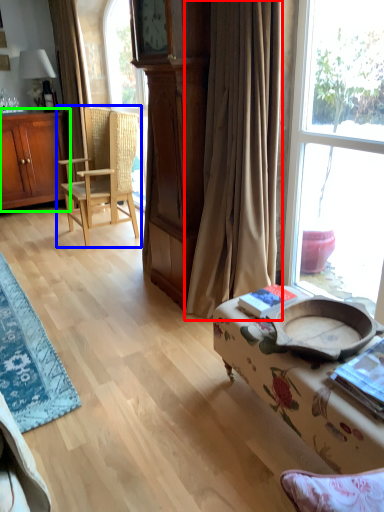
Question: Considering the real-world distances, which object is farthest from curtain (highlighted by a red box)? chair (highlighted by a blue box) or cabinetry (highlighted by a green box)?

Choices:
 (A) chair
 (B) cabinetry

Answer: (B)